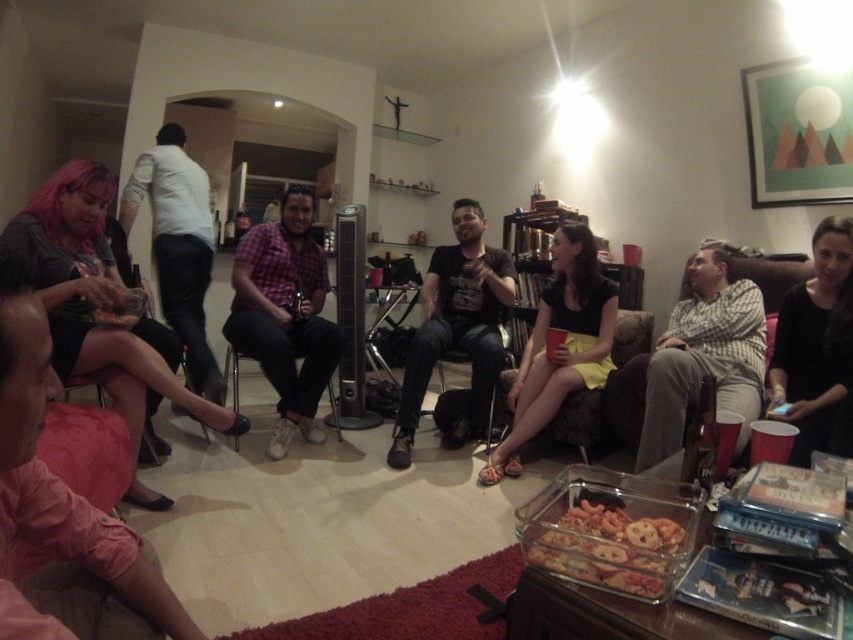
You are a guest at this gathering and want to sit down. You see the pink fabric skirt at lower left and the yellow fabric skirt at center. Which one is closer to the floor?

The pink fabric skirt at lower left is closer to the floor since it is located below the yellow fabric skirt at center.